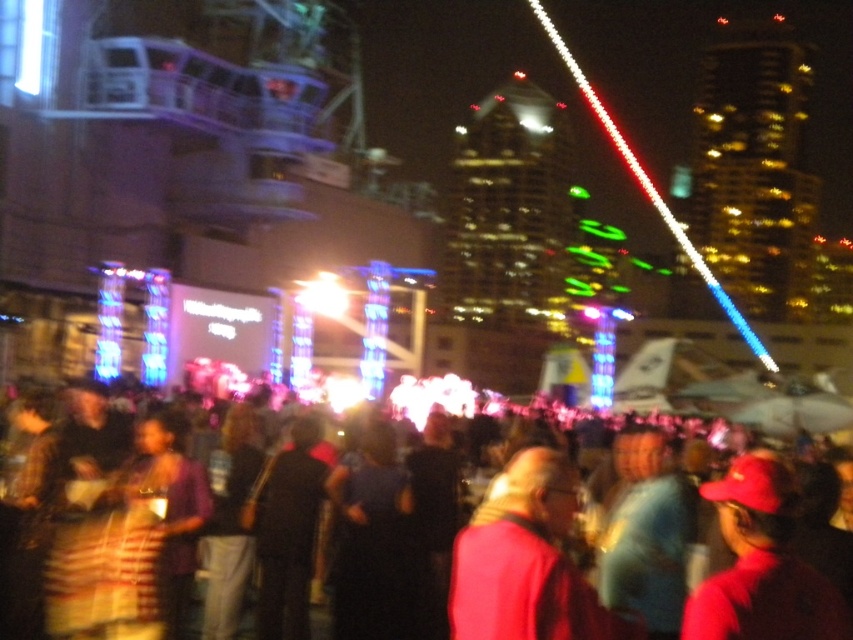
You are a photographer at the event and want to capture a photo that includes both the red fabric crowd at center and the red matte cap at lower right. Based on their positions, where should you position your camera to ensure both are in the frame?

Since the red fabric crowd at center is located above the red matte cap at lower right, you should position your camera at a lower angle to capture both the red fabric crowd at center and the red matte cap at lower right in the frame.

You are a photographer trying to capture the pink fabric at center during the event. Based on its position, where should you aim your camera to ensure it is centered in your shot?

To center the pink fabric at center in your shot, aim your camera at the coordinates point (526, 561) as that is the 2D location of the pink fabric at center.